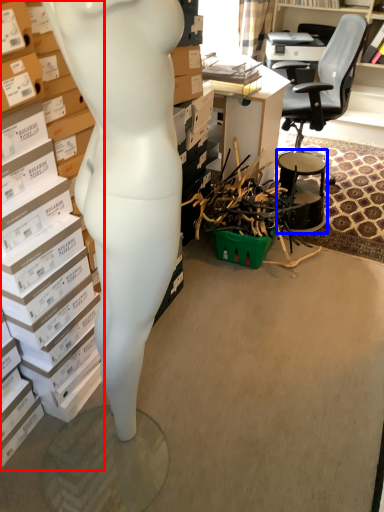
Question: Which object is closer to the camera taking this photo, book (highlighted by a red box) or drum (highlighted by a blue box)?

Choices:
 (A) book
 (B) drum

Answer: (A)